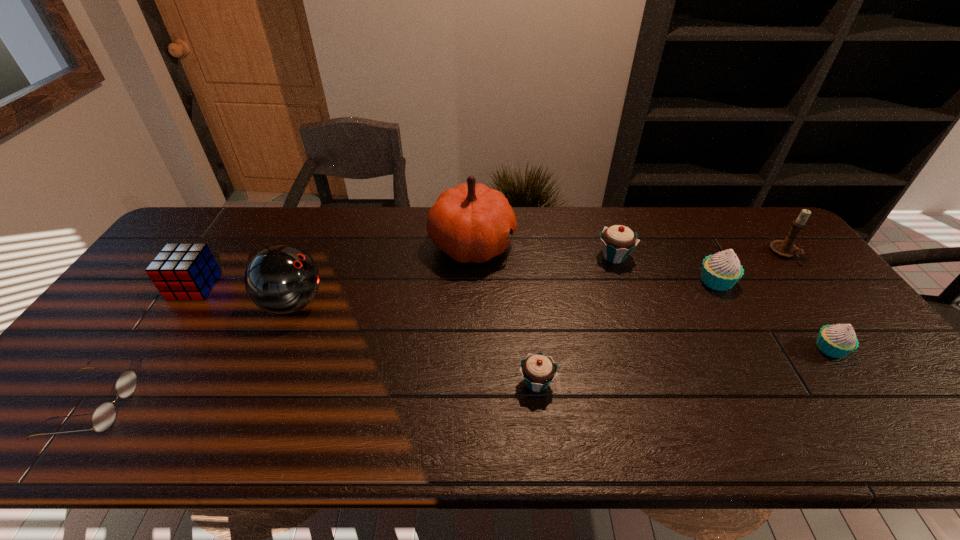
In order to click on vacant region located on the left of the farther teal cupcake in this screenshot , I will do `click(491, 256)`.

Identify the location of vacant space located on the front of the red cube. (106, 418).

You are a GUI agent. You are given a task and a screenshot of the screen. Output one action in this format:
    pyautogui.click(x=<x>, y=<y>)
    Task: Click on the vacant area situated on the back of the rightmost cupcake
    The height and width of the screenshot is (540, 960).
    Given the screenshot: What is the action you would take?
    pyautogui.click(x=757, y=248)

Locate an element on the screen. The image size is (960, 540). free space located 0.110m on the front of the left teal cupcake is located at coordinates (543, 446).

This screenshot has height=540, width=960. What are the coordinates of `vacant area situated on the temples of the shortest object` in the screenshot? It's located at (251, 408).

The height and width of the screenshot is (540, 960). I want to click on pumpkin at the far edge, so click(x=471, y=222).

Locate an element on the screen. This screenshot has width=960, height=540. candle holder located at the far edge is located at coordinates (785, 248).

Find the location of `cupcake positioned at the far edge`. cupcake positioned at the far edge is located at coordinates (618, 241).

In order to click on object that is at the near edge in this screenshot , I will do `click(103, 417)`.

At what (x,y) coordinates should I click in order to perform the action: click on cube that is at the left edge. Please return your answer as a coordinate pair (x, y). Looking at the image, I should click on (186, 271).